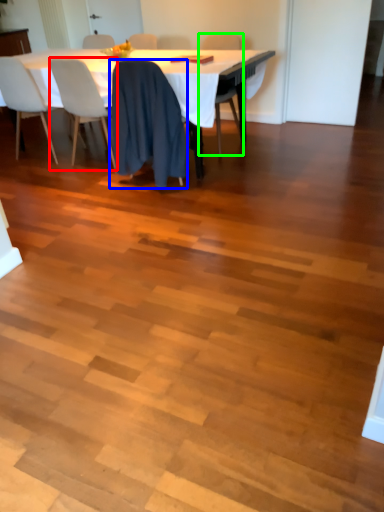
Question: Considering the real-world distances, which object is farthest from chair (highlighted by a red box)? chair (highlighted by a blue box) or chair (highlighted by a green box)?

Choices:
 (A) chair
 (B) chair

Answer: (B)